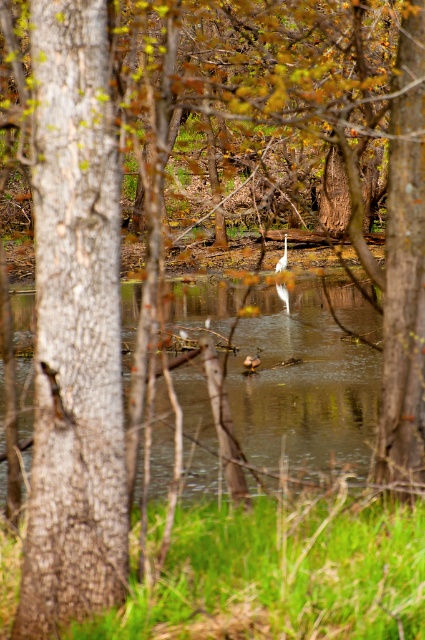
Question: Which object is the closest to the rough bark tree at left?

Choices:
 (A) white matte bird at center
 (B) clear water at center

Answer: (B)

Question: Which is nearer to the rough bark tree at left?

Choices:
 (A) clear water at center
 (B) white matte bird at center

Answer: (A)

Question: Which is farther from the clear water at center?

Choices:
 (A) white matte bird at center
 (B) rough bark tree at left

Answer: (B)

Question: Can you confirm if rough bark tree at left is thinner than clear water at center?

Choices:
 (A) yes
 (B) no

Answer: (A)

Question: Is clear water at center positioned behind white matte bird at center?

Choices:
 (A) yes
 (B) no

Answer: (B)

Question: Where is rough bark tree at left located in relation to white matte bird at center in the image?

Choices:
 (A) right
 (B) left

Answer: (B)